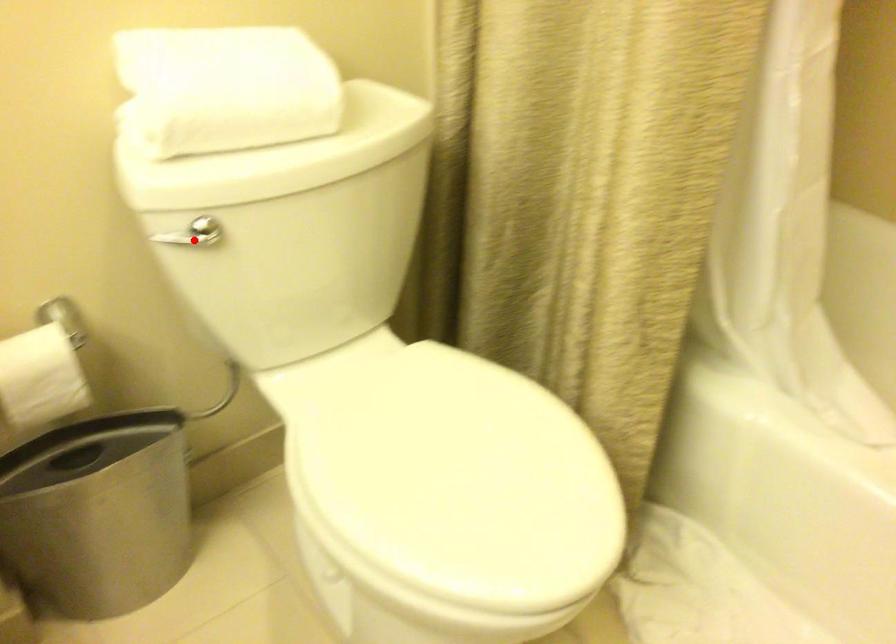
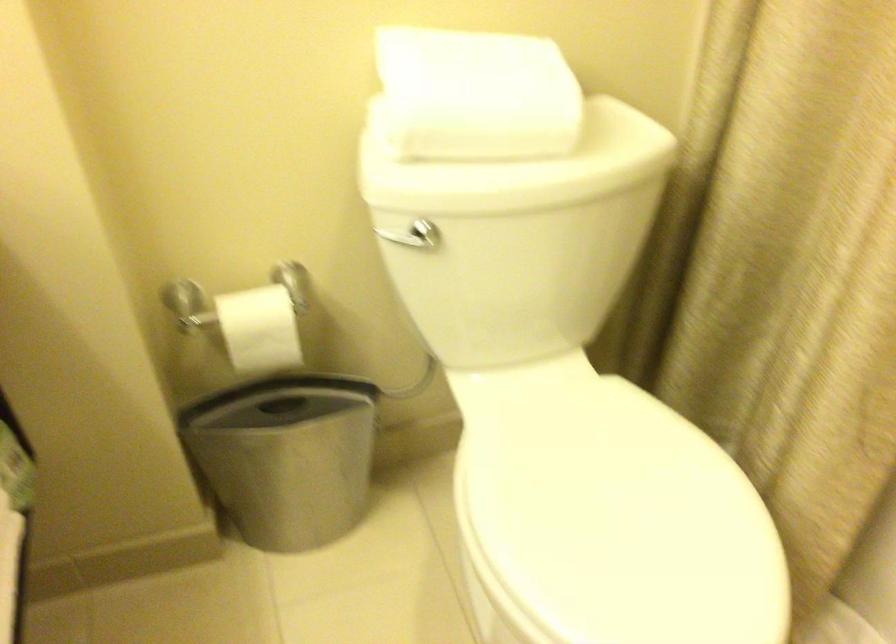
Where in the second image is the point corresponding to the highlighted location from the first image?

(410, 241)